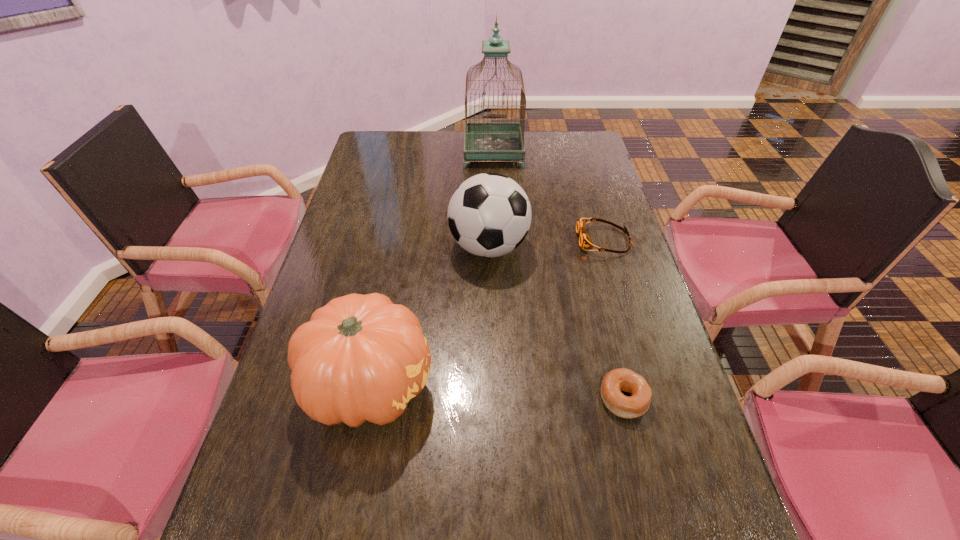
I want to click on free space that satisfies the following two spatial constraints: 1. with the lenses facing forward on the goggles; 2. on the front side of the bagel, so click(650, 398).

The image size is (960, 540). In order to click on vacant space that satisfies the following two spatial constraints: 1. on the carved face of the leftmost object; 2. on the back side of the bagel in this screenshot , I will do `click(368, 398)`.

Image resolution: width=960 pixels, height=540 pixels. Find the location of `free space in the image that satisfies the following two spatial constraints: 1. on the carved face of the leftmost object; 2. on the back side of the bagel`. free space in the image that satisfies the following two spatial constraints: 1. on the carved face of the leftmost object; 2. on the back side of the bagel is located at coordinates (368, 398).

Where is `vacant space that satisfies the following two spatial constraints: 1. on the front side of the soccer ball; 2. on the carved face of the pumpkin`? This screenshot has height=540, width=960. vacant space that satisfies the following two spatial constraints: 1. on the front side of the soccer ball; 2. on the carved face of the pumpkin is located at coordinates (492, 385).

At what (x,y) coordinates should I click in order to perform the action: click on free point that satisfies the following two spatial constraints: 1. at the door of the tallest object; 2. on the right side of the bagel. Please return your answer as a coordinate pair (x, y). The height and width of the screenshot is (540, 960). Looking at the image, I should click on (503, 398).

The image size is (960, 540). I want to click on vacant space that satisfies the following two spatial constraints: 1. on the front side of the bagel; 2. on the right side of the soccer ball, so click(492, 398).